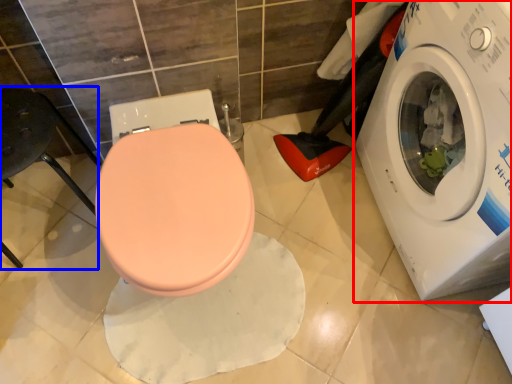
Question: Which object is closer to the camera taking this photo, washing machine (highlighted by a red box) or chair (highlighted by a blue box)?

Choices:
 (A) washing machine
 (B) chair

Answer: (A)